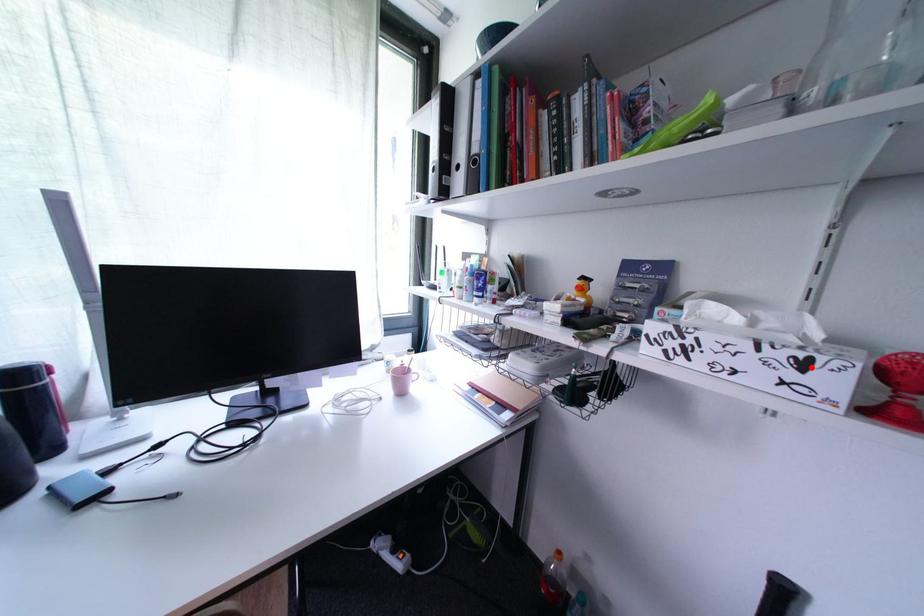
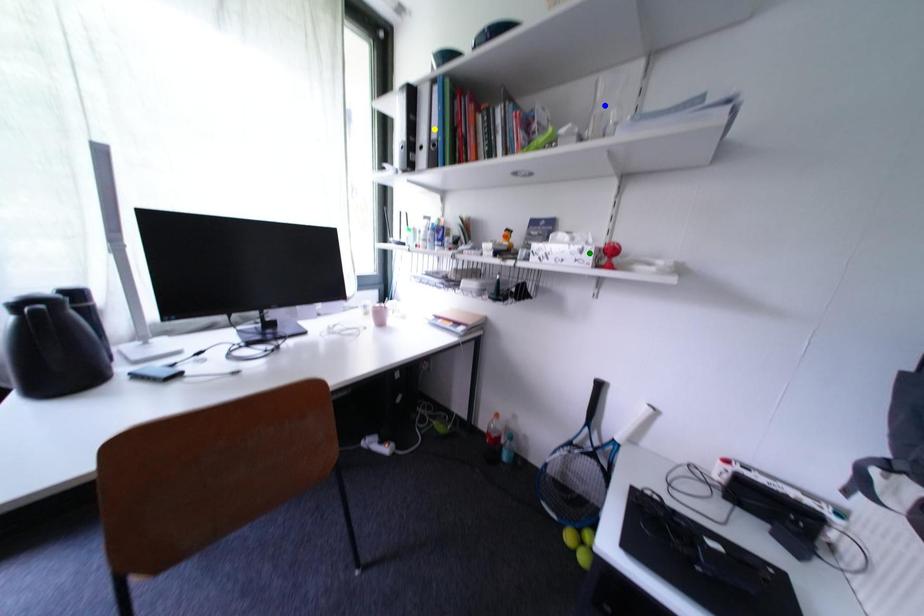
Question: I am providing you with two images of the same scene from different viewpoints. A red point is marked on the first image. You are given multiple points on the second image. Which spot in image 2 lines up with the point in image 1?

Choices:
 (A) green point
 (B) yellow point
 (C) blue point

Answer: (A)